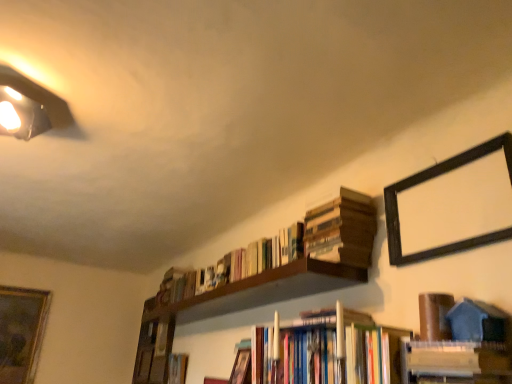
Question: From a real-world perspective, is hardcover books at center, the 6th book from the back, located higher than wooden book at upper right, placed as the fourth book when sorted from back to front?

Choices:
 (A) yes
 (B) no

Answer: (B)

Question: From the image's perspective, does hardcover books at center, the 6th book from the back, appear higher than wooden book at upper right, which is the 4th book from front to back?

Choices:
 (A) no
 (B) yes

Answer: (A)

Question: Is hardcover books at center, which ranks as the 2th book in front-to-back order, turned away from wooden book at upper right, placed as the fourth book when sorted from back to front?

Choices:
 (A) no
 (B) yes

Answer: (A)

Question: Is hardcover books at center, the 6th book from the back, at the left side of wooden book at upper right, which is the 4th book from front to back?

Choices:
 (A) yes
 (B) no

Answer: (A)

Question: Are hardcover books at center, which ranks as the 2th book in front-to-back order, and wooden book at upper right, placed as the fourth book when sorted from back to front, beside each other?

Choices:
 (A) no
 (B) yes

Answer: (A)

Question: Is hardcover books at center, the 6th book from the back, bigger than wooden book at upper right, which is the 4th book from front to back?

Choices:
 (A) yes
 (B) no

Answer: (A)

Question: Is black wood picture frame at upper right, which is counted as the first picture frame, starting from the right, shorter than hardcover book at center, arranged as the 2th book when viewed from the back?

Choices:
 (A) yes
 (B) no

Answer: (B)

Question: Is black wood picture frame at upper right, the first picture frame from the front, aimed at hardcover book at center, which is the 6th book in front-to-back order?

Choices:
 (A) no
 (B) yes

Answer: (A)

Question: Does black wood picture frame at upper right, which is the first picture frame in top-to-bottom order, have a smaller size compared to hardcover book at center, which is the 6th book in front-to-back order?

Choices:
 (A) yes
 (B) no

Answer: (B)

Question: Considering the relative positions of black wood picture frame at upper right, which is the second picture frame in back-to-front order, and hardcover book at center, arranged as the 2th book when viewed from the back, in the image provided, is black wood picture frame at upper right, which is the second picture frame in back-to-front order, to the left of hardcover book at center, arranged as the 2th book when viewed from the back, from the viewer's perspective?

Choices:
 (A) no
 (B) yes

Answer: (A)

Question: Is black wood picture frame at upper right, the 2th picture frame positioned from the left, looking in the opposite direction of hardcover book at center, arranged as the 2th book when viewed from the back?

Choices:
 (A) no
 (B) yes

Answer: (A)

Question: From a real-world perspective, is black wood picture frame at upper right, the 2th picture frame positioned from the left, positioned under hardcover book at center, arranged as the 2th book when viewed from the back, based on gravity?

Choices:
 (A) no
 (B) yes

Answer: (A)

Question: From a real-world perspective, is brown matte book at upper right, positioned as the 5th book in back-to-front order, on top of hardcover books at center, which ranks as the 2th book in front-to-back order?

Choices:
 (A) yes
 (B) no

Answer: (A)